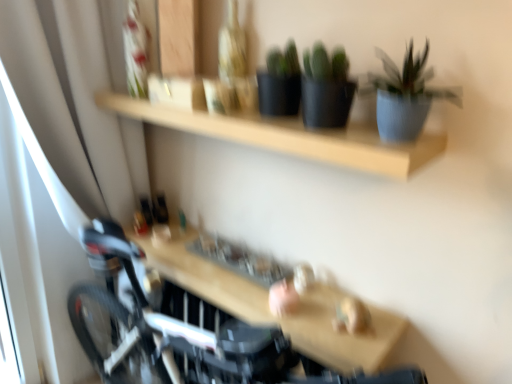
Identify the location of free region under blue matte pot at upper right (from a real-world perspective). Image resolution: width=512 pixels, height=384 pixels. (394, 147).